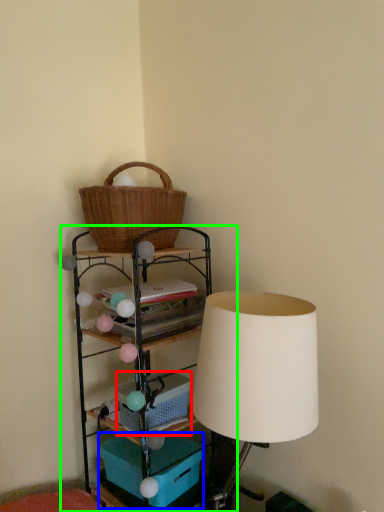
Question: Considering the real-world distances, which object is farthest from basket (highlighted by a red box)? storage box (highlighted by a blue box) or shelf (highlighted by a green box)?

Choices:
 (A) storage box
 (B) shelf

Answer: (A)